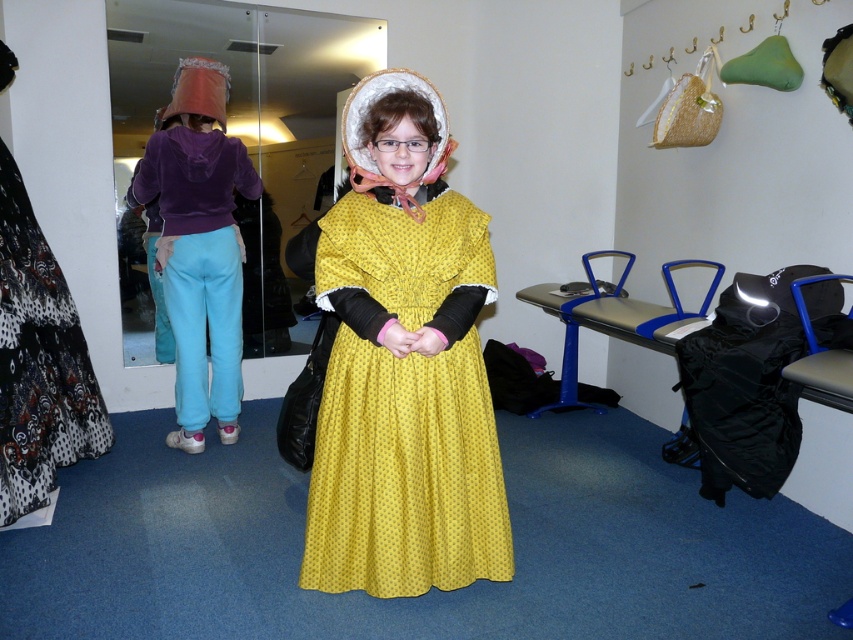
You are organizing a costume party and need to ensure that all costumes fit properly. You have a yellow dotted fabric dress at center and a purple velvet hoodie at left. Which costume has a smaller size?

The yellow dotted fabric dress at center has a smaller size compared to the purple velvet hoodie at left.

Consider the image. You are a costume designer observing the scene. You need to determine the spatial relationship between the yellow dotted fabric dress at center and the black and white patterned skirt at left. Which one is positioned lower in the image?

The yellow dotted fabric dress at center is positioned lower than the black and white patterned skirt at left as it is described to be below it.

You are a costume designer trying to decide the order of layers for a historical scene. You see the purple velvet hoodie at left and the black and white patterned skirt at left. Which item is closer to the viewer?

The purple velvet hoodie at left is positioned over the black and white patterned skirt at left, so the purple velvet hoodie at left is closer to the viewer.